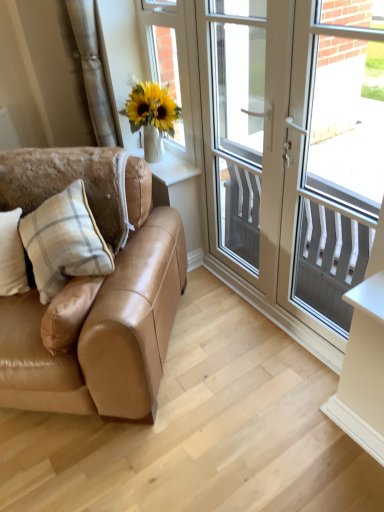
What do you see at coordinates (340, 158) in the screenshot?
I see `white textured screen at right, the first window screen when ordered from right to left` at bounding box center [340, 158].

In order to face satin tan leather couch at left, should I rotate leftwards or rightwards?

Rotate your view left by about 20.455°.

The image size is (384, 512). What do you see at coordinates (102, 324) in the screenshot?
I see `satin tan leather couch at left` at bounding box center [102, 324].

Image resolution: width=384 pixels, height=512 pixels. Describe the element at coordinates (64, 241) in the screenshot. I see `beige plaid pillow at left, positioned as the first pillow in right-to-left order` at that location.

What is the approximate height of beige plaid pillow at left, positioned as the first pillow in right-to-left order?

beige plaid pillow at left, positioned as the first pillow in right-to-left order, is 16.31 inches tall.

This screenshot has width=384, height=512. Describe the element at coordinates (95, 71) in the screenshot. I see `beige fabric curtain at upper left` at that location.

Where is `beige fabric curtain at upper left`? Image resolution: width=384 pixels, height=512 pixels. beige fabric curtain at upper left is located at coordinates (95, 71).

Locate an element on the screen. This screenshot has height=512, width=384. white textured screen at right, the first window screen when ordered from right to left is located at coordinates (340, 158).

From the image's perspective, is white plaid pillow at left, the second pillow when ordered from right to left, under white plastic door at center?

Yes, from the image's perspective, white plaid pillow at left, the second pillow when ordered from right to left, is beneath white plastic door at center.

How different are the orientations of white plaid pillow at left, the second pillow when ordered from right to left, and white plastic door at center in degrees?

They differ by 52.8 degrees in their facing directions.

Does point (17, 241) lie behind point (237, 59)?

No, it is in front of (237, 59).

I want to click on the 2nd pillow to the left of the white plastic door at center, counting from the anchor's position, so point(12,255).

From a real-world perspective, relative to matte glass vase at upper left, positioned as the 2th window screen in right-to-left order, is beige fabric curtain at upper left vertically above or below?

Clearly, from a real-world perspective, beige fabric curtain at upper left is above matte glass vase at upper left, positioned as the 2th window screen in right-to-left order.

Would you consider beige fabric curtain at upper left to be distant from matte glass vase at upper left, positioned as the 2th window screen in right-to-left order?

No, beige fabric curtain at upper left is not far away from matte glass vase at upper left, positioned as the 2th window screen in right-to-left order.

Which object is further away from the camera taking this photo, beige fabric curtain at upper left or matte glass vase at upper left, arranged as the 1th window screen when viewed from the left?

beige fabric curtain at upper left.

Can you confirm if beige fabric curtain at upper left is thinner than matte glass vase at upper left, arranged as the 1th window screen when viewed from the left?

No.

Based on the photo, how many degrees apart are the facing directions of matte glass vase at upper left, positioned as the 2th window screen in right-to-left order, and beige fabric curtain at upper left?

matte glass vase at upper left, positioned as the 2th window screen in right-to-left order, and beige fabric curtain at upper left are facing 1.05 degrees away from each other.

Considering the positions of objects matte glass vase at upper left, positioned as the 2th window screen in right-to-left order, and beige fabric curtain at upper left in the image provided, who is behind, matte glass vase at upper left, positioned as the 2th window screen in right-to-left order, or beige fabric curtain at upper left?

Positioned behind is beige fabric curtain at upper left.

Is matte glass vase at upper left, positioned as the 2th window screen in right-to-left order, at the right side of beige fabric curtain at upper left?

Yes.

Is satin tan leather couch at left placed right next to beige plaid pillow at left, the second pillow from the left?

No, satin tan leather couch at left is not making contact with beige plaid pillow at left, the second pillow from the left.

In terms of size, does satin tan leather couch at left appear bigger or smaller than beige plaid pillow at left, the second pillow from the left?

Clearly, satin tan leather couch at left is larger in size than beige plaid pillow at left, the second pillow from the left.

Which object is closer to the camera taking this photo, satin tan leather couch at left or beige plaid pillow at left, positioned as the first pillow in right-to-left order?

satin tan leather couch at left is closer to the camera.

Is satin tan leather couch at left to the left or to the right of beige plaid pillow at left, the second pillow from the left, in the image?

satin tan leather couch at left is positioned on beige plaid pillow at left, the second pillow from the left,'s left side.

Which is in front, white glossy screen door at upper right or matte glass vase at upper left, arranged as the 1th window screen when viewed from the left?

white glossy screen door at upper right is more forward.

Between white glossy screen door at upper right and matte glass vase at upper left, positioned as the 2th window screen in right-to-left order, which one has larger size?

white glossy screen door at upper right.

Can we say white glossy screen door at upper right lies outside matte glass vase at upper left, positioned as the 2th window screen in right-to-left order?

white glossy screen door at upper right lies outside matte glass vase at upper left, positioned as the 2th window screen in right-to-left order,'s area.

Identify the location of screen door lying on the right of matte glass vase at upper left, positioned as the 2th window screen in right-to-left order. click(x=245, y=130).

Is white textured screen at right, arranged as the 2th window screen when viewed from the left, not close to white plastic door at center?

Yes, white textured screen at right, arranged as the 2th window screen when viewed from the left, is far from white plastic door at center.

From the image's perspective, is white textured screen at right, the first window screen when ordered from right to left, located above white plastic door at center?

No, from the image's perspective, white textured screen at right, the first window screen when ordered from right to left, is not on top of white plastic door at center.

From a real-world perspective, is white textured screen at right, arranged as the 2th window screen when viewed from the left, under white plastic door at center?

Actually, white textured screen at right, arranged as the 2th window screen when viewed from the left, is physically above white plastic door at center in the real world.

Which is behind, white textured screen at right, the first window screen when ordered from right to left, or white plastic door at center?

white plastic door at center is further from the camera.

Consider the image. Does matte glass vase at upper left, positioned as the 2th window screen in right-to-left order, lie behind white plaid pillow at left, placed as the 1th pillow when sorted from left to right?

Yes, matte glass vase at upper left, positioned as the 2th window screen in right-to-left order, is further from the camera.

From the image's perspective, is matte glass vase at upper left, positioned as the 2th window screen in right-to-left order, beneath white plaid pillow at left, placed as the 1th pillow when sorted from left to right?

Actually, matte glass vase at upper left, positioned as the 2th window screen in right-to-left order, appears above white plaid pillow at left, placed as the 1th pillow when sorted from left to right, in the image.

How many degrees apart are the facing directions of matte glass vase at upper left, arranged as the 1th window screen when viewed from the left, and white plaid pillow at left, the second pillow when ordered from right to left?

52.2 degrees separate the facing orientations of matte glass vase at upper left, arranged as the 1th window screen when viewed from the left, and white plaid pillow at left, the second pillow when ordered from right to left.

From a real-world perspective, between matte glass vase at upper left, positioned as the 2th window screen in right-to-left order, and white plaid pillow at left, placed as the 1th pillow when sorted from left to right, who is vertically higher?

In real-world perspective, matte glass vase at upper left, positioned as the 2th window screen in right-to-left order, is above.

You are a GUI agent. You are given a task and a screenshot of the screen. Output one action in this format:
    pyautogui.click(x=<x>, y=<y>)
    Task: Click on the 2nd pillow located beneath the white plastic door at center (from a real-world perspective)
    
    Given the screenshot: What is the action you would take?
    pyautogui.click(x=12, y=255)

This screenshot has height=512, width=384. In order to click on the 1st window screen positioned below the beige fabric curtain at upper left (from the image's perspective) in this screenshot , I will do `click(169, 62)`.

Which object lies nearer to the anchor point satin tan leather couch at left, beige plaid pillow at left, positioned as the first pillow in right-to-left order, or white textured screen at right, arranged as the 2th window screen when viewed from the left?

Among the two, beige plaid pillow at left, positioned as the first pillow in right-to-left order, is located nearer to satin tan leather couch at left.

Which object lies nearer to the anchor point beige fabric curtain at upper left, beige plaid pillow at left, the second pillow from the left, or matte glass vase at upper left, arranged as the 1th window screen when viewed from the left?

Among the two, matte glass vase at upper left, arranged as the 1th window screen when viewed from the left, is located nearer to beige fabric curtain at upper left.

From the picture: Looking at the image, which one is located closer to white glossy screen door at upper right, beige fabric curtain at upper left or beige plaid pillow at left, positioned as the first pillow in right-to-left order?

beige fabric curtain at upper left is positioned closer to the anchor white glossy screen door at upper right.

Based on their spatial positions, is white plaid pillow at left, the second pillow when ordered from right to left, or beige fabric curtain at upper left closer to white glossy screen door at upper right?

The object closer to white glossy screen door at upper right is beige fabric curtain at upper left.

Based on their spatial positions, is white glossy screen door at upper right or beige fabric curtain at upper left further from matte glass vase at upper left, arranged as the 1th window screen when viewed from the left?

white glossy screen door at upper right is positioned further to the anchor matte glass vase at upper left, arranged as the 1th window screen when viewed from the left.

When comparing their distances from matte glass vase at upper left, positioned as the 2th window screen in right-to-left order, does beige fabric curtain at upper left or beige plaid pillow at left, the second pillow from the left, seem further?

The object further to matte glass vase at upper left, positioned as the 2th window screen in right-to-left order, is beige plaid pillow at left, the second pillow from the left.

When comparing their distances from beige fabric curtain at upper left, does matte glass vase at upper left, arranged as the 1th window screen when viewed from the left, or satin tan leather couch at left seem closer?

The object closer to beige fabric curtain at upper left is matte glass vase at upper left, arranged as the 1th window screen when viewed from the left.

From the image, which object appears to be nearer to white plastic door at center, satin tan leather couch at left or white glossy screen door at upper right?

white glossy screen door at upper right is closer to white plastic door at center.

Where is `screen door between satin tan leather couch at left and white textured screen at right, the first window screen when ordered from right to left`? The width and height of the screenshot is (384, 512). screen door between satin tan leather couch at left and white textured screen at right, the first window screen when ordered from right to left is located at coordinates (245, 130).

Image resolution: width=384 pixels, height=512 pixels. Identify the location of screen door between matte glass vase at upper left, positioned as the 2th window screen in right-to-left order, and satin tan leather couch at left from top to bottom. (245, 130).

You are a GUI agent. You are given a task and a screenshot of the screen. Output one action in this format:
    pyautogui.click(x=<x>, y=<y>)
    Task: Click on the pillow between matte glass vase at upper left, positioned as the 2th window screen in right-to-left order, and white plaid pillow at left, placed as the 1th pillow when sorted from left to right, vertically
    
    Given the screenshot: What is the action you would take?
    pyautogui.click(x=64, y=241)

Where is `screen door between satin tan leather couch at left and white plastic door at center from left to right`? The image size is (384, 512). screen door between satin tan leather couch at left and white plastic door at center from left to right is located at coordinates (245, 130).